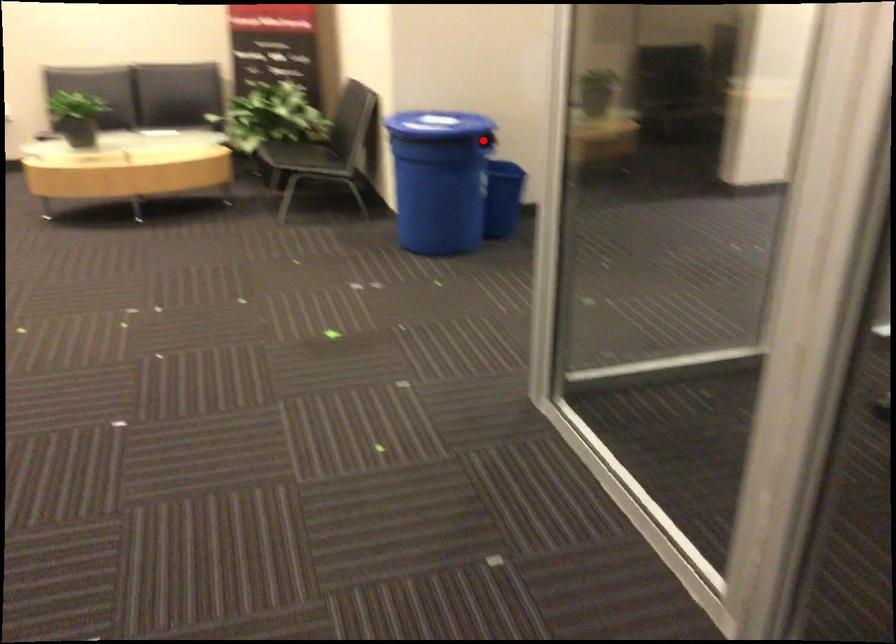
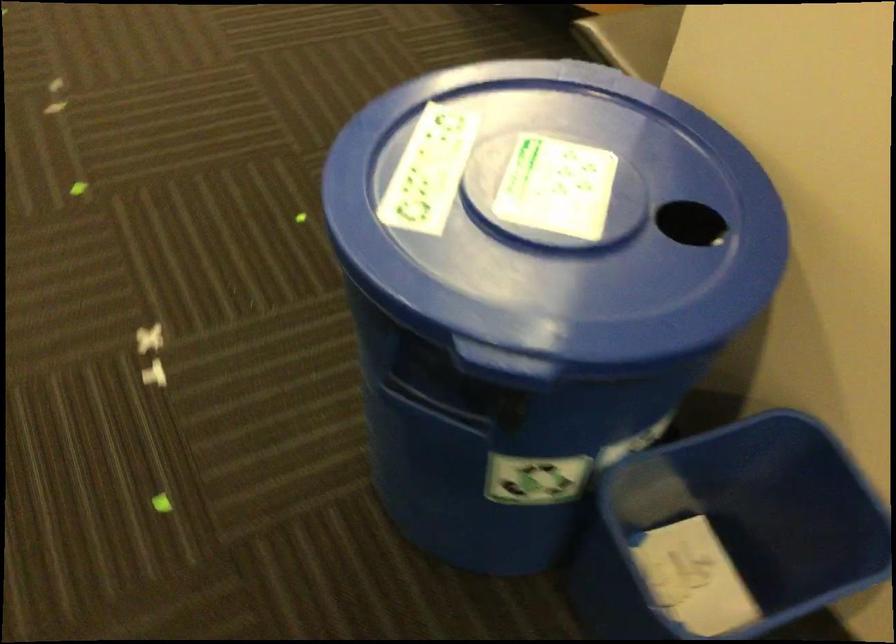
Find the pixel in the second image that matches the highlighted location in the first image.

(426, 406)